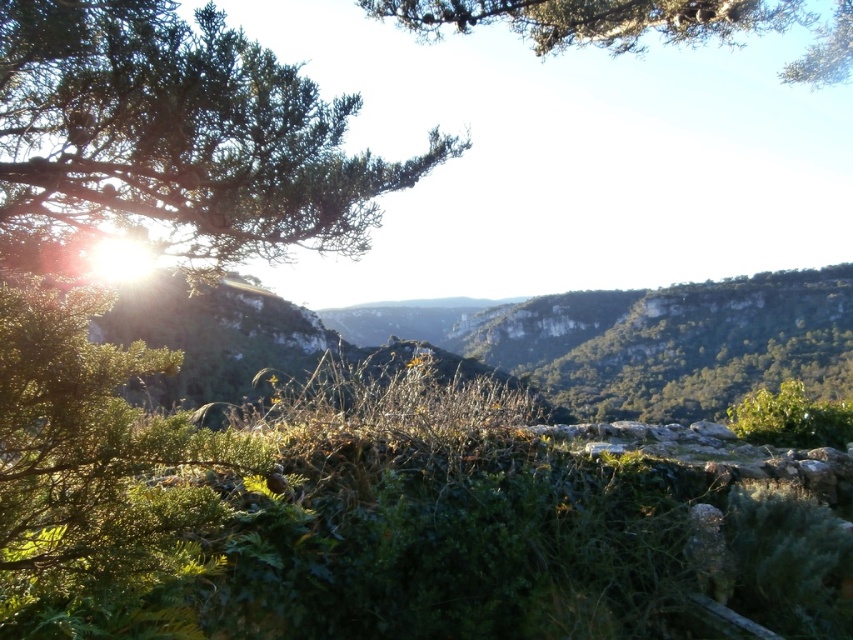
Does green leafy branch at upper left have a smaller size compared to green leafy tree at upper center?

Correct, green leafy branch at upper left occupies less space than green leafy tree at upper center.

In the scene shown: Between green leafy branch at upper left and green leafy tree at upper center, which one has less height?

Standing shorter between the two is green leafy branch at upper left.

Is point (62, 88) more distant than point (552, 49)?

No, (62, 88) is in front of (552, 49).

The height and width of the screenshot is (640, 853). In order to click on green leafy branch at upper left in this screenshot , I will do `click(173, 138)`.